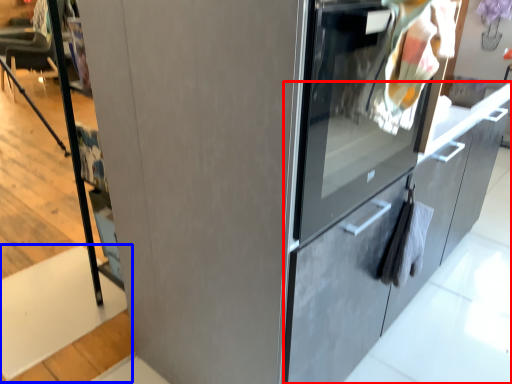
Question: Which object appears closest to the camera in this image, cabinetry (highlighted by a red box) or stair (highlighted by a blue box)?

Choices:
 (A) cabinetry
 (B) stair

Answer: (A)